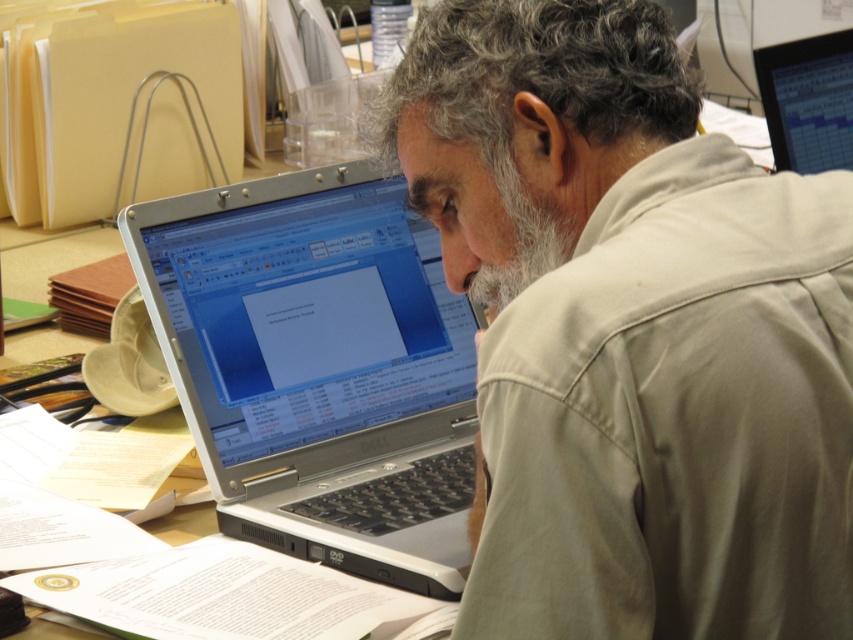
Does beige cotton shirt at center lie behind silver metallic laptop at center?

No, beige cotton shirt at center is in front of silver metallic laptop at center.

Consider the image. Is beige cotton shirt at center to the right of silver metallic laptop at center from the viewer's perspective?

Indeed, beige cotton shirt at center is positioned on the right side of silver metallic laptop at center.

Does point (840, 445) come farther from viewer compared to point (337, 508)?

No, (840, 445) is in front of (337, 508).

At what (x,y) coordinates should I click in order to perform the action: click on beige cotton shirt at center. Please return your answer as a coordinate pair (x, y). Looking at the image, I should click on (633, 332).

Between beige cotton shirt at center and matte black computer screen at upper right, which one is positioned higher?

Positioned higher is matte black computer screen at upper right.

Which of these two, beige cotton shirt at center or matte black computer screen at upper right, stands shorter?

With less height is matte black computer screen at upper right.

The width and height of the screenshot is (853, 640). What are the coordinates of `beige cotton shirt at center` in the screenshot? It's located at (633, 332).

This screenshot has height=640, width=853. In order to click on beige cotton shirt at center in this screenshot , I will do `click(633, 332)`.

Who is positioned more to the left, silver metallic laptop at center or matte black computer screen at upper right?

silver metallic laptop at center is more to the left.

Consider the image. Who is more forward, (271, 378) or (776, 54)?

Point (271, 378) is more forward.

Is point (189, 259) closer to camera compared to point (780, 72)?

Yes, it is.

Find the location of a particular element. This screenshot has width=853, height=640. silver metallic laptop at center is located at coordinates (318, 368).